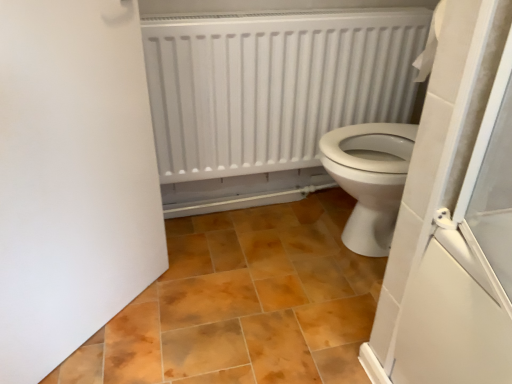
Question: Is brown matte tile at center facing away from white matte radiator at upper center?

Choices:
 (A) yes
 (B) no

Answer: (B)

Question: Considering the relative sizes of brown matte tile at center and white matte radiator at upper center in the image provided, is brown matte tile at center wider than white matte radiator at upper center?

Choices:
 (A) yes
 (B) no

Answer: (A)

Question: Is brown matte tile at center located outside white matte radiator at upper center?

Choices:
 (A) no
 (B) yes

Answer: (B)

Question: Is brown matte tile at center shorter than white matte radiator at upper center?

Choices:
 (A) yes
 (B) no

Answer: (A)

Question: Is brown matte tile at center to the right of white matte radiator at upper center from the viewer's perspective?

Choices:
 (A) yes
 (B) no

Answer: (B)

Question: Could you tell me if brown matte tile at center is turned towards white matte radiator at upper center?

Choices:
 (A) no
 (B) yes

Answer: (A)

Question: Can you confirm if white matte radiator at upper center is thinner than white matte door at left?

Choices:
 (A) yes
 (B) no

Answer: (B)

Question: From a real-world perspective, is white matte radiator at upper center physically below white matte door at left?

Choices:
 (A) yes
 (B) no

Answer: (B)

Question: From the image's perspective, is white matte radiator at upper center on white matte door at left?

Choices:
 (A) yes
 (B) no

Answer: (A)

Question: Is white matte radiator at upper center positioned with its back to white matte door at left?

Choices:
 (A) yes
 (B) no

Answer: (B)

Question: Is white matte radiator at upper center shorter than white matte door at left?

Choices:
 (A) yes
 (B) no

Answer: (A)

Question: Is white matte door at left completely or partially inside white matte radiator at upper center?

Choices:
 (A) yes
 (B) no

Answer: (B)

Question: Does brown matte tile at center have a greater height compared to white matte door at left?

Choices:
 (A) no
 (B) yes

Answer: (A)